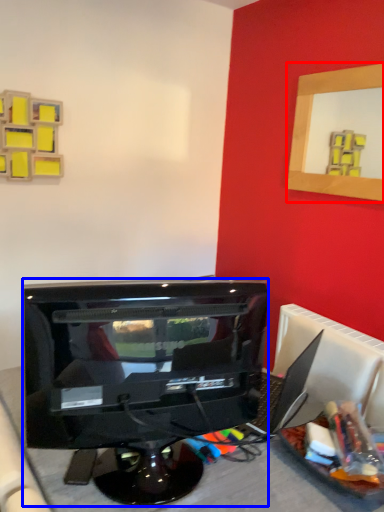
Question: Among these objects, which one is farthest to the camera, picture frame (highlighted by a red box) or computer monitor (highlighted by a blue box)?

Choices:
 (A) picture frame
 (B) computer monitor

Answer: (A)